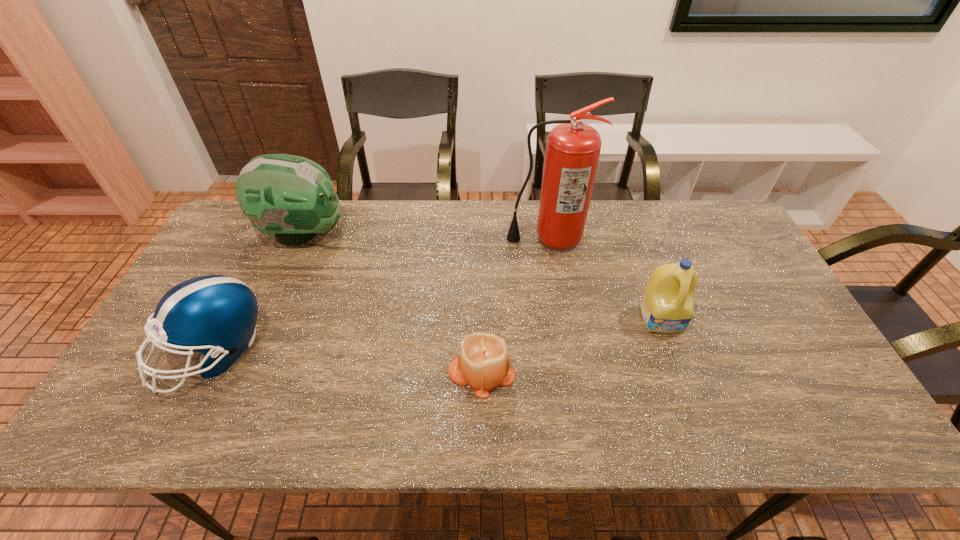
The height and width of the screenshot is (540, 960). Find the location of `empty location between the detergent and the candle`. empty location between the detergent and the candle is located at coordinates (572, 345).

The height and width of the screenshot is (540, 960). Identify the location of free spot between the detergent and the candle. (572, 345).

Find the location of `blank region between the shorter football helmet and the farther football helmet`. blank region between the shorter football helmet and the farther football helmet is located at coordinates (258, 293).

This screenshot has width=960, height=540. I want to click on vacant space that's between the taller football helmet and the shorter football helmet, so click(x=258, y=293).

At what (x,y) coordinates should I click in order to perform the action: click on free space between the shorter football helmet and the shortest object. Please return your answer as a coordinate pair (x, y). The image size is (960, 540). Looking at the image, I should click on pyautogui.click(x=348, y=362).

At what (x,y) coordinates should I click in order to perform the action: click on free point between the rightmost object and the shortest object. Please return your answer as a coordinate pair (x, y). The width and height of the screenshot is (960, 540). Looking at the image, I should click on point(572,345).

Where is `vacant space that's between the tallest object and the nearer football helmet`? This screenshot has width=960, height=540. vacant space that's between the tallest object and the nearer football helmet is located at coordinates (380, 295).

Where is `free space that is in between the taller football helmet and the shortest object`? free space that is in between the taller football helmet and the shortest object is located at coordinates (392, 302).

Identify the location of the second closest object to the detergent. (483, 364).

Locate which object is the fourth closest to the tallest object. Please provide its 2D coordinates. Your answer should be formatted as a tuple, i.e. [(x, y)], where the tuple contains the x and y coordinates of a point satisfying the conditions above.

[(213, 314)]